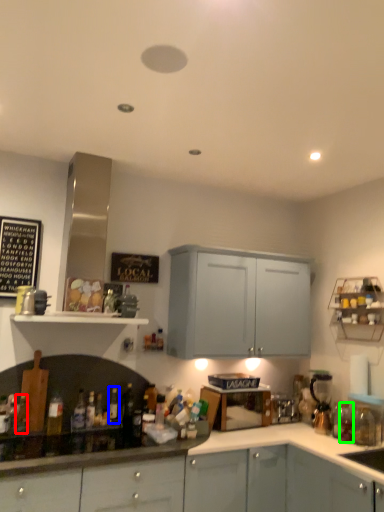
Question: Estimate the real-world distances between objects in this image. Which object is closer to bottle (highlighted by a red box), bottle (highlighted by a blue box) or bottle (highlighted by a green box)?

Choices:
 (A) bottle
 (B) bottle

Answer: (A)